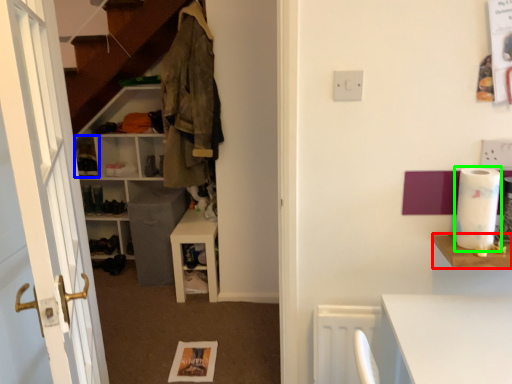
Question: Which is farther away from shelf (highlighted by a red box)? cabinet (highlighted by a blue box) or toilet paper (highlighted by a green box)?

Choices:
 (A) cabinet
 (B) toilet paper

Answer: (A)